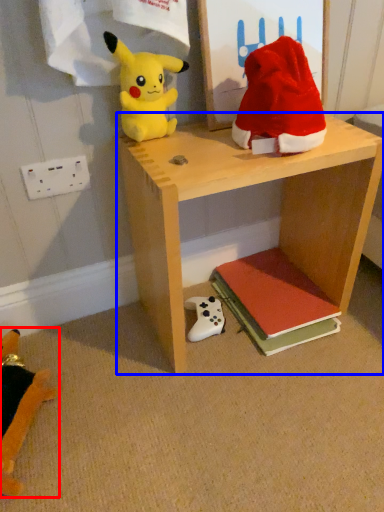
Question: Which object is further to the camera taking this photo, toy (highlighted by a red box) or shelf (highlighted by a blue box)?

Choices:
 (A) toy
 (B) shelf

Answer: (A)